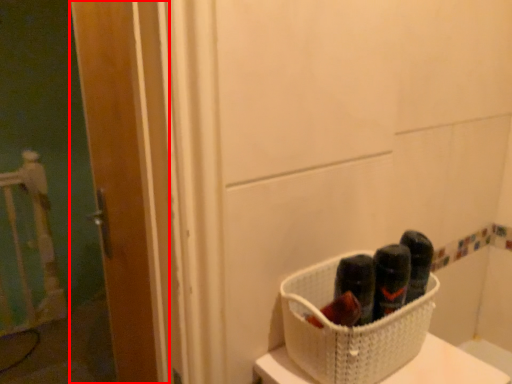
Question: From the image, what is the correct spatial relationship of door (annotated by the red box) in relation to basket?

Choices:
 (A) right
 (B) left

Answer: (B)